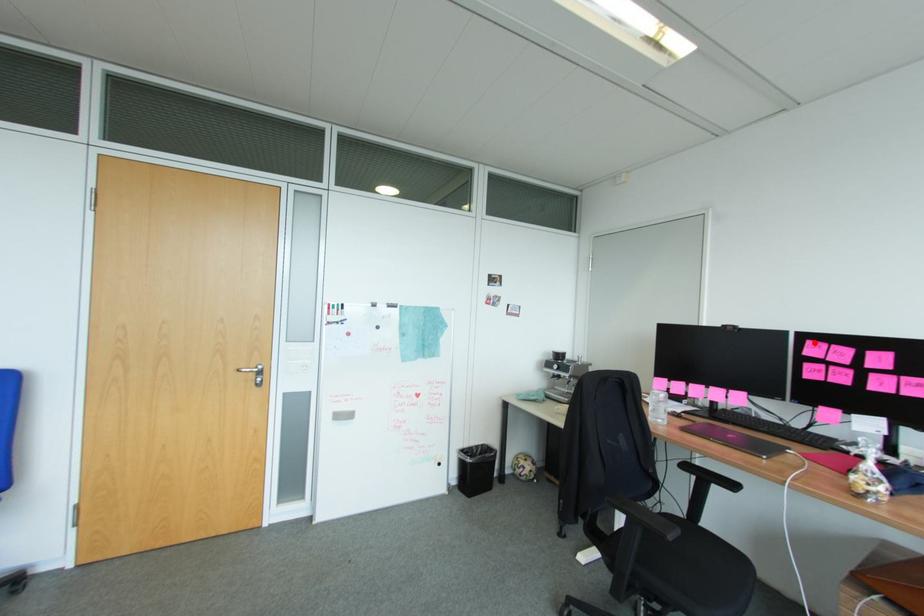
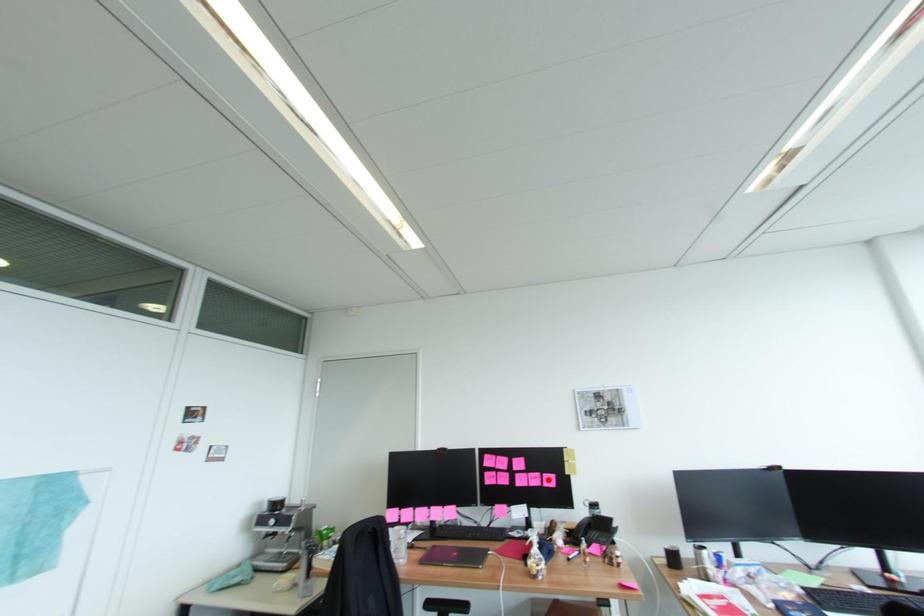
I am providing you with two images of the same scene from different viewpoints. A red point is marked on the first image and another point is marked on the second image. Is the red point in image1 aligned with the point shown in image2?

No